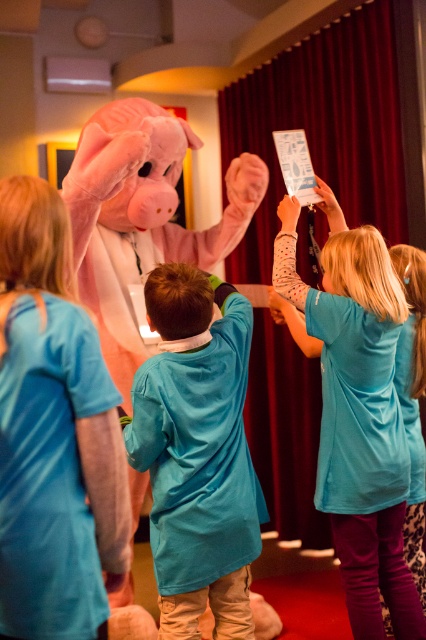
Who is positioned more to the left, velvet red curtain at upper center or blue cotton shirt at center?

blue cotton shirt at center is more to the left.

Can you confirm if velvet red curtain at upper center is thinner than blue cotton shirt at center?

No, velvet red curtain at upper center is not thinner than blue cotton shirt at center.

Where is `velvet red curtain at upper center`? The height and width of the screenshot is (640, 426). velvet red curtain at upper center is located at coordinates (324, 129).

Which is in front, point (48, 612) or point (175, 573)?

Point (48, 612)

From the picture: Who is taller, pink plush costume at left or blue cotton shirt at center?

Standing taller between the two is blue cotton shirt at center.

Between point (43, 568) and point (216, 508), which one is positioned behind?

The point (216, 508) is more distant.

This screenshot has width=426, height=640. I want to click on pink plush costume at left, so click(x=55, y=433).

Is point (227, 556) behind point (328, 280)?

No, it is in front of (328, 280).

Is blue cotton shirt at center to the right of blue fabric dress at center from the viewer's perspective?

In fact, blue cotton shirt at center is to the left of blue fabric dress at center.

You are a GUI agent. You are given a task and a screenshot of the screen. Output one action in this format:
    pyautogui.click(x=<x>, y=<y>)
    Task: Click on the blue cotton shirt at center
    The image size is (426, 640).
    Given the screenshot: What is the action you would take?
    pyautogui.click(x=198, y=452)

Image resolution: width=426 pixels, height=640 pixels. Identify the location of blue cotton shirt at center. click(x=198, y=452).